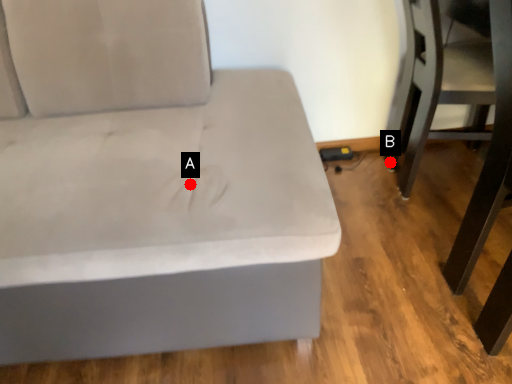
Question: Two points are circled on the image, labeled by A and B beside each circle. Which point is farther from the camera taking this photo?

Choices:
 (A) A is further
 (B) B is further

Answer: (B)